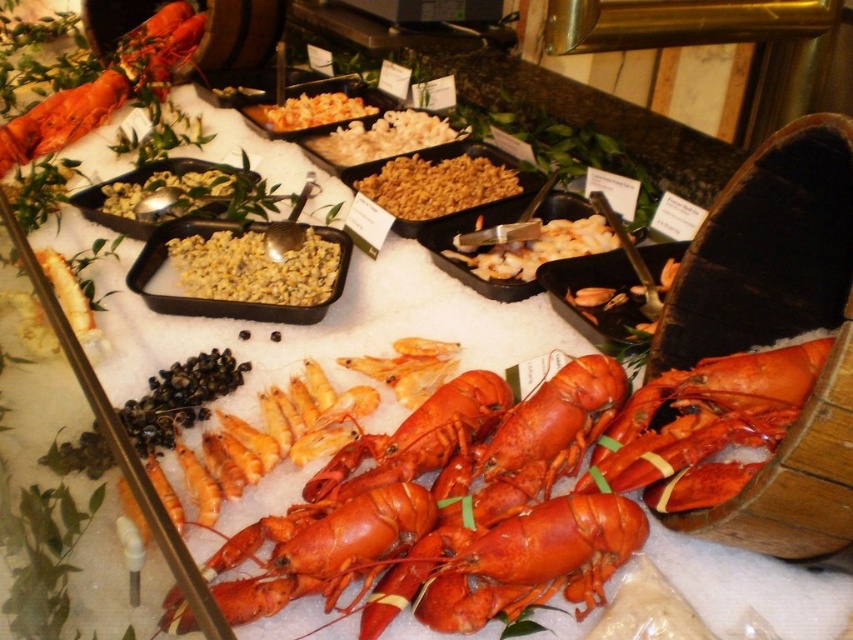
Question: Which point is farther to the camera?

Choices:
 (A) yellow corn at center
 (B) shiny orange lobster at upper left
 (C) shiny red lobster at center
 (D) yellowish matte corn at center

Answer: (D)

Question: Which of these objects is positioned farthest from the shiny red lobster at center?

Choices:
 (A) shiny orange lobster at upper left
 (B) yellowish matte corn at center
 (C) yellow corn at center

Answer: (A)

Question: Does yellow corn at center appear on the right side of yellowish matte corn at center?

Choices:
 (A) yes
 (B) no

Answer: (B)

Question: Which point is closer to the camera taking this photo?

Choices:
 (A) (276, 122)
 (B) (227, 273)
 (C) (585, 246)

Answer: (B)

Question: Can you confirm if shiny red lobster at center is wider than yellow corn at center?

Choices:
 (A) no
 (B) yes

Answer: (B)

Question: Is shiny red lobster at center positioned before yellow matte corn at center?

Choices:
 (A) yes
 (B) no

Answer: (A)